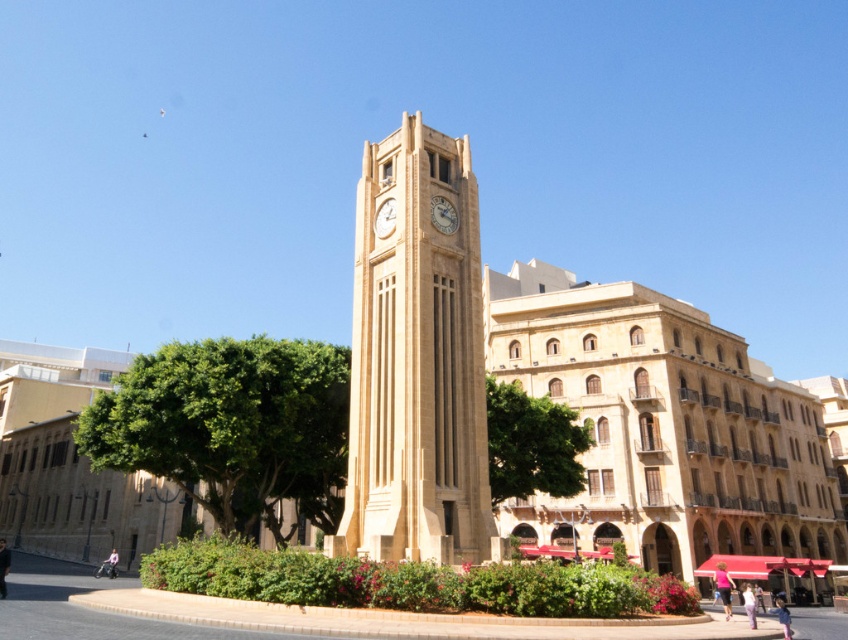
You are planning to place a bench between the green leafy tree at center and the golden textured clock at center. The bench is 10 feet long. Will there be enough space between them to place the bench without moving either object?

The green leafy tree at center and golden textured clock at center are 66.76 feet apart, so there is sufficient space to place a 10 feet long bench between them without needing to move either object.

You are a city planner evaluating the view of the clock tower from the plaza. You need to determine if the golden textured clock at center will be visible above the green leafy tree at center. Based on their heights, can you confirm this?

The green leafy tree at center is taller than the golden textured clock at center, so the golden textured clock at center will not be visible above the green leafy tree at center.

You are standing in the public square looking at the beige stone clock tower at center and the golden textured clock at center. Which object is closer to the ground?

The beige stone clock tower at center is closer to the ground because it is positioned under the golden textured clock at center.